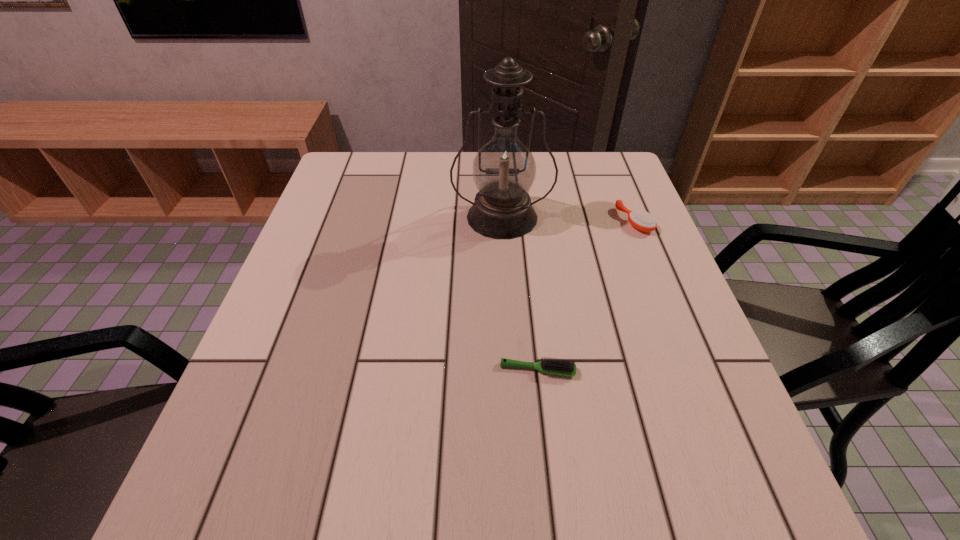
Find the location of a particular element. Image resolution: width=960 pixels, height=540 pixels. the tallest object is located at coordinates (504, 169).

This screenshot has height=540, width=960. What are the coordinates of `the rightmost object` in the screenshot? It's located at (641, 220).

Image resolution: width=960 pixels, height=540 pixels. Identify the location of the second shortest object. (641, 220).

The width and height of the screenshot is (960, 540). In order to click on the shortest object in this screenshot , I will do `click(559, 367)`.

Locate an element on the screen. The width and height of the screenshot is (960, 540). the nearer hairbrush is located at coordinates pyautogui.click(x=559, y=367).

Locate an element on the screen. This screenshot has height=540, width=960. free region located 0.110m on the back of the tallest object is located at coordinates (499, 175).

Locate an element on the screen. free space located on the front of the farther hairbrush is located at coordinates (684, 349).

Image resolution: width=960 pixels, height=540 pixels. I want to click on free space located on the front of the shorter hairbrush, so click(x=549, y=475).

I want to click on object that is at the far edge, so click(x=504, y=169).

Find the location of a particular element. The height and width of the screenshot is (540, 960). object present at the right edge is located at coordinates (641, 220).